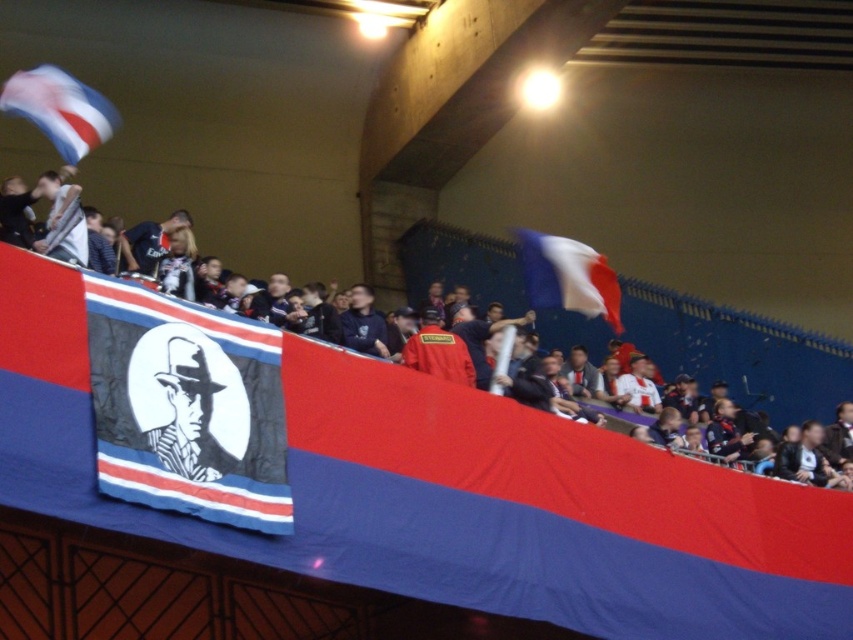
Question: Which point is closer to the camera?

Choices:
 (A) (190, 385)
 (B) (219, 509)

Answer: (B)

Question: Where is black and white fabric banner at center located in relation to black and white portrait at center in the image?

Choices:
 (A) right
 (B) left

Answer: (A)

Question: Is the position of matte black banner at center more distant than that of white fabric flag at upper center?

Choices:
 (A) yes
 (B) no

Answer: (B)

Question: Estimate the real-world distances between objects in this image. Which object is closer to the matte black banner at center?

Choices:
 (A) black and white fabric banner at center
 (B) white fabric flag at upper center
 (C) black and white portrait at center
 (D) blue and white fabric flag at upper left

Answer: (B)

Question: Estimate the real-world distances between objects in this image. Which object is closer to the black and white portrait at center?

Choices:
 (A) matte black banner at center
 (B) blue and white fabric flag at upper left
 (C) white fabric flag at upper center
 (D) black and white fabric banner at center

Answer: (D)

Question: Is matte black banner at center to the left of blue and white fabric flag at upper left from the viewer's perspective?

Choices:
 (A) yes
 (B) no

Answer: (B)